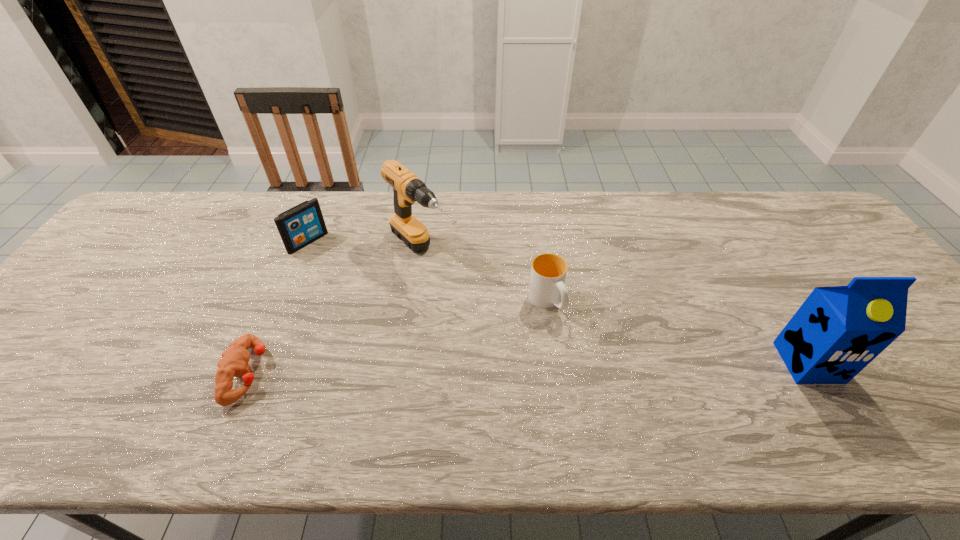
Identify the location of vacant space situated on the front screen of the iPod. (388, 307).

This screenshot has width=960, height=540. Find the location of `free space located on the front screen of the iPod`. free space located on the front screen of the iPod is located at coordinates (350, 277).

The width and height of the screenshot is (960, 540). In order to click on vacant space situated on the front screen of the iPod in this screenshot , I will do `click(344, 272)`.

You are a GUI agent. You are given a task and a screenshot of the screen. Output one action in this format:
    pyautogui.click(x=<x>, y=<y>)
    Task: Click on the free space located 0.230m with the handle on the side of the cup
    
    Given the screenshot: What is the action you would take?
    pyautogui.click(x=608, y=395)

At what (x,y) coordinates should I click in order to perform the action: click on free space located with the handle on the side of the cup. Please return your answer as a coordinate pair (x, y). The image size is (960, 540). Looking at the image, I should click on (579, 353).

The image size is (960, 540). I want to click on vacant space located with the handle on the side of the cup, so click(x=608, y=395).

Locate an element on the screen. The width and height of the screenshot is (960, 540). drill located in the far edge section of the desktop is located at coordinates tap(407, 188).

This screenshot has width=960, height=540. I want to click on iPod at the far edge, so click(302, 224).

Image resolution: width=960 pixels, height=540 pixels. In order to click on puncher that is positioned at the near edge in this screenshot , I will do `click(234, 360)`.

Identify the location of carton situated at the near edge. The width and height of the screenshot is (960, 540). (838, 330).